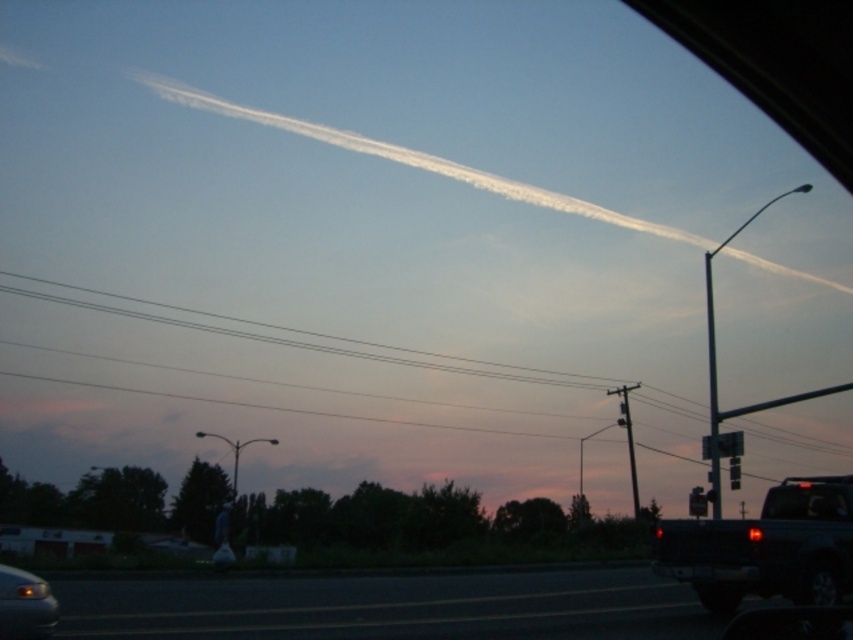
Question: Which point is closer to the camera?

Choices:
 (A) (48, 618)
 (B) (677, 576)

Answer: (A)

Question: Does matte black truck at lower right have a greater width compared to matte black car at lower left?

Choices:
 (A) no
 (B) yes

Answer: (B)

Question: Where is matte black truck at lower right located in relation to matte black car at lower left in the image?

Choices:
 (A) below
 (B) above

Answer: (A)

Question: Does matte black truck at lower right have a smaller size compared to matte black car at lower left?

Choices:
 (A) yes
 (B) no

Answer: (B)

Question: Which point appears farthest from the camera in this image?

Choices:
 (A) (33, 616)
 (B) (836, 573)

Answer: (B)